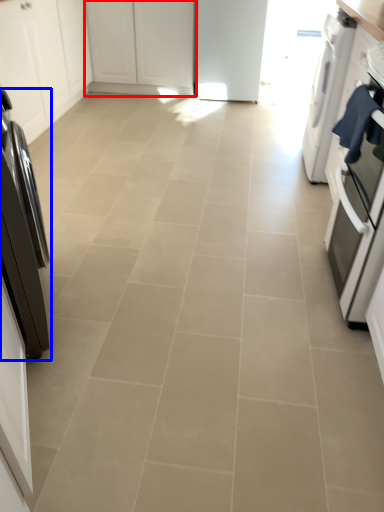
Question: Which point is closer to the camera, cabinetry (highlighted by a red box) or home appliance (highlighted by a blue box)?

Choices:
 (A) cabinetry
 (B) home appliance

Answer: (B)